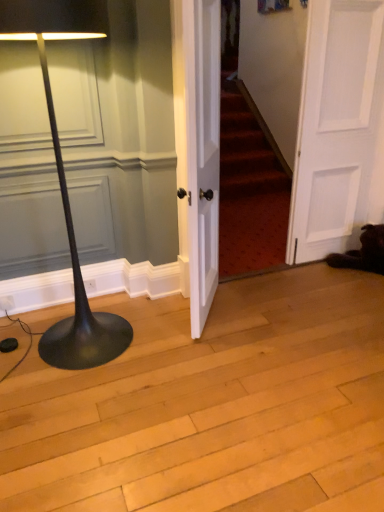
Where is `vacant space that is to the left of white wood door at center, the first door positioned from the left`? This screenshot has height=512, width=384. vacant space that is to the left of white wood door at center, the first door positioned from the left is located at coordinates (161, 320).